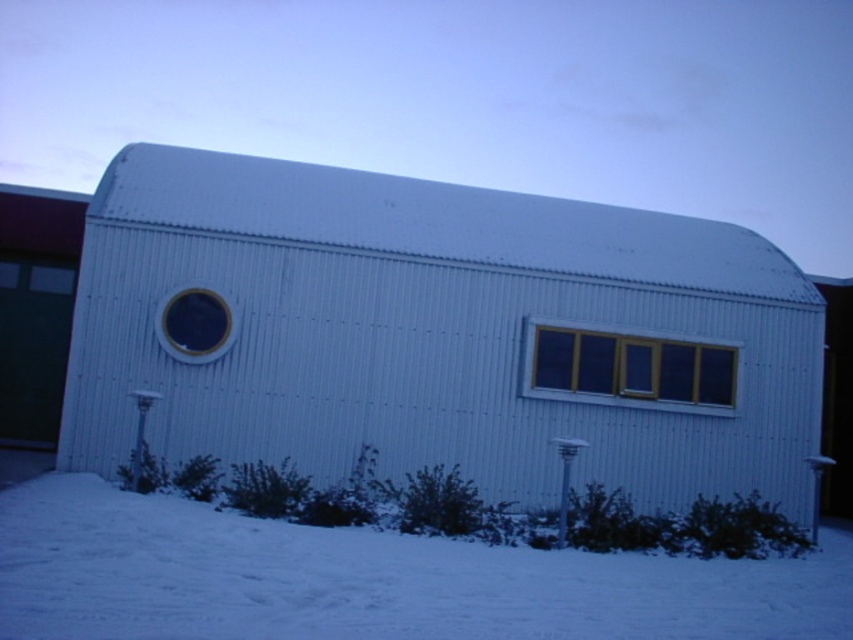
You are standing in front of the building and notice the white powdery snow at lower center and the yellow matte window at center. Which object is positioned to the left of the other?

The white powdery snow at lower center is to the left of the yellow matte window at center.